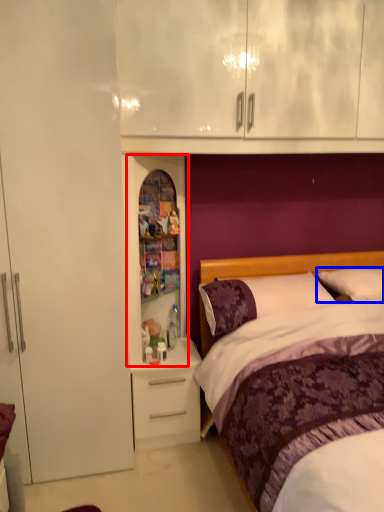
Question: Among these objects, which one is farthest to the camera, medicine cabinet (highlighted by a red box) or pillow (highlighted by a blue box)?

Choices:
 (A) medicine cabinet
 (B) pillow

Answer: (B)